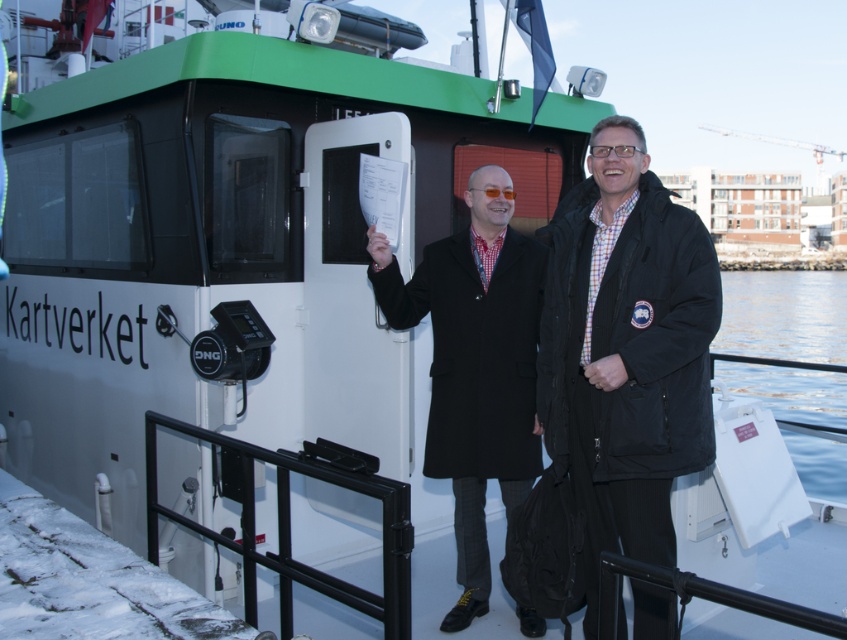
Question: Can you confirm if matte black coat at center is positioned to the left of clear water at lower right?

Choices:
 (A) no
 (B) yes

Answer: (B)

Question: Can you confirm if black wool coat at center is wider than matte black coat at center?

Choices:
 (A) yes
 (B) no

Answer: (B)

Question: Based on their relative distances, which object is nearer to the matte black coat at center?

Choices:
 (A) black wool coat at center
 (B) clear water at lower right

Answer: (A)

Question: Which point is closer to the camera taking this photo?

Choices:
 (A) (624, 154)
 (B) (452, 275)
 (C) (807, 474)

Answer: (A)

Question: Is matte black coat at center wider than clear water at lower right?

Choices:
 (A) no
 (B) yes

Answer: (A)

Question: Which point is farther from the camera taking this photo?

Choices:
 (A) (602, 310)
 (B) (385, 307)

Answer: (B)